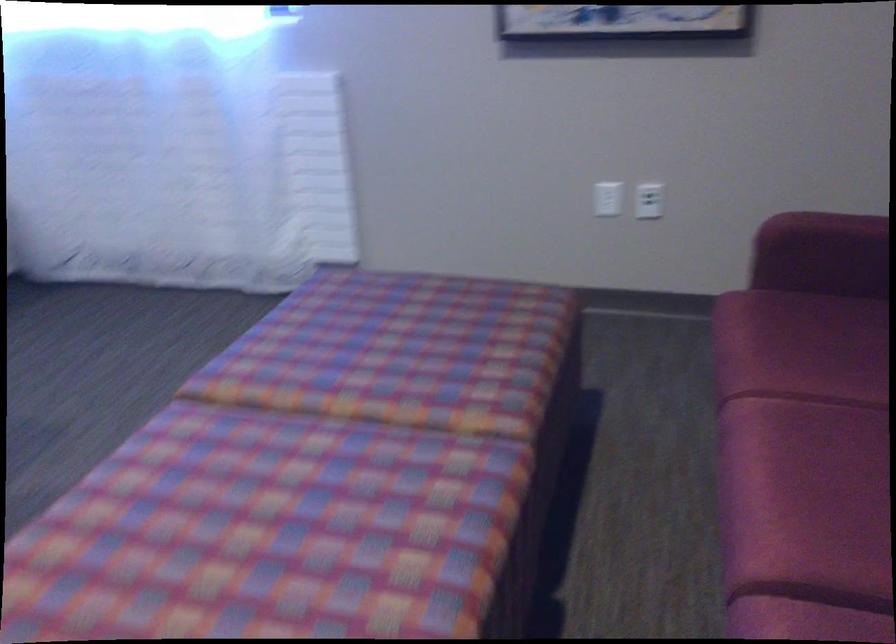
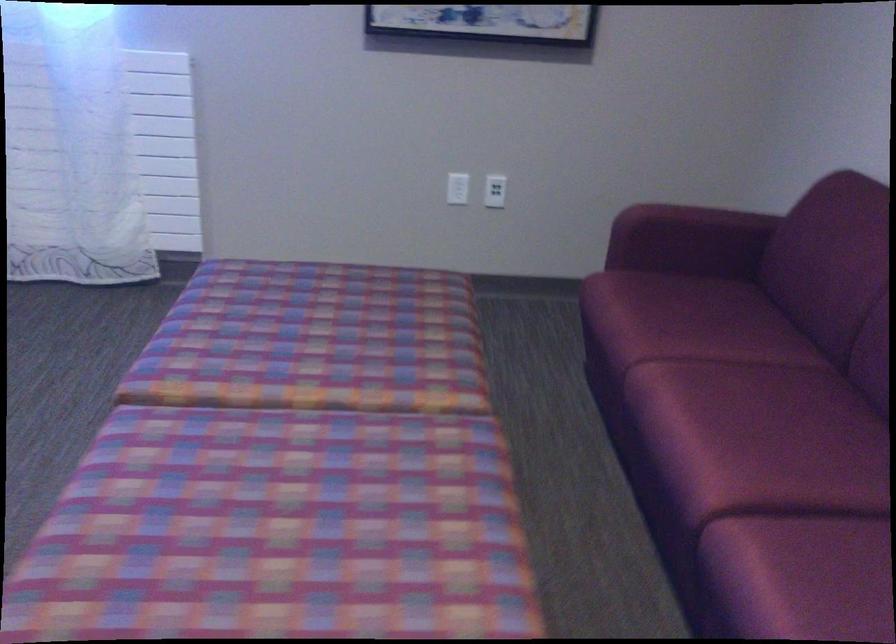
Question: How did the camera likely rotate?

Choices:
 (A) Left
 (B) Right
 (C) Up
 (D) Down

Answer: (B)